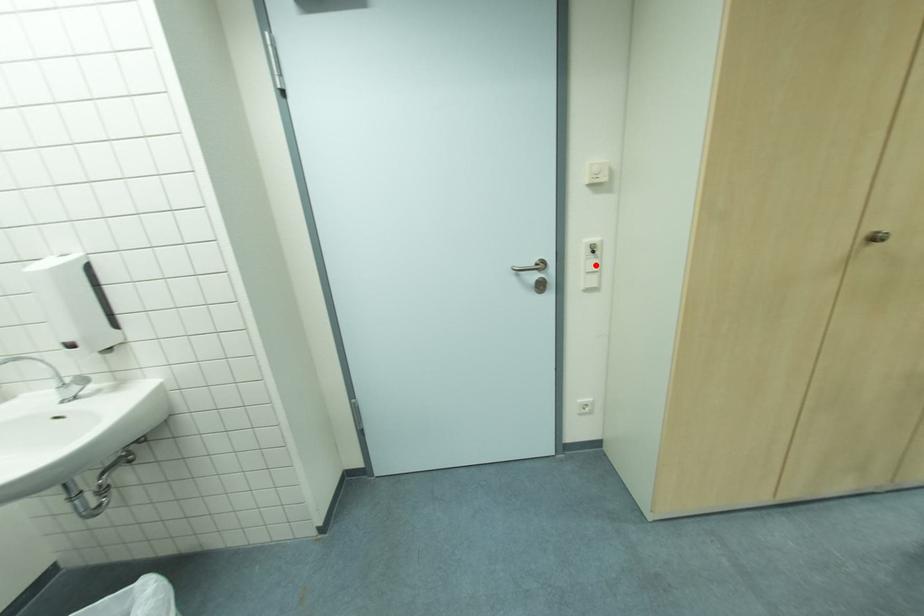
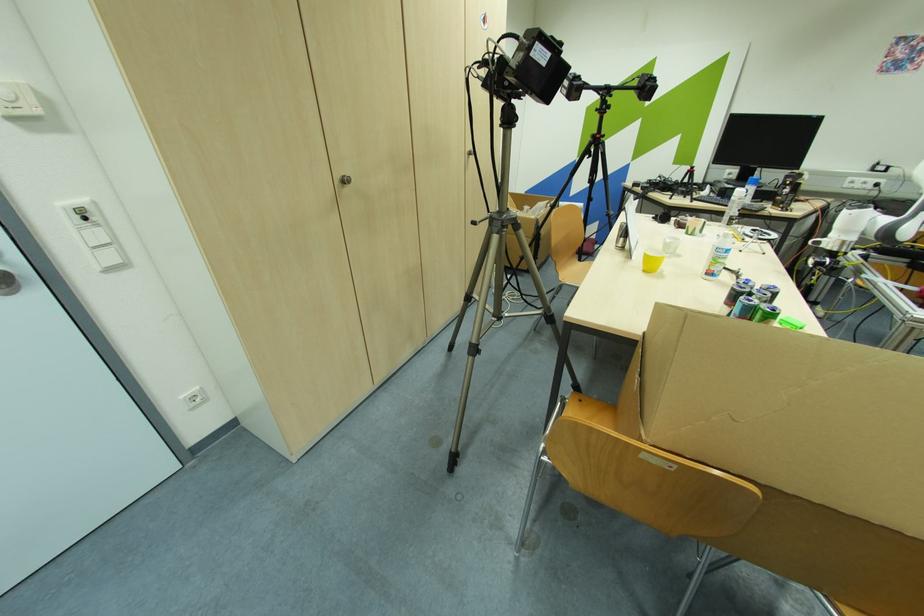
Locate, in the second image, the point that corresponds to the highlighted location in the first image.

(102, 236)